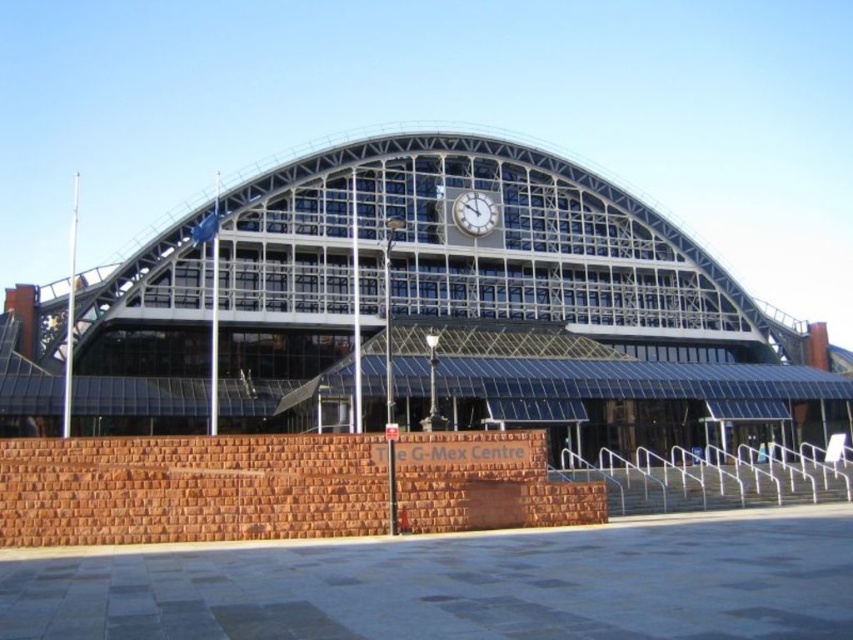
Question: Does glassy steel railway station at center appear on the right side of white metallic clock at center?

Choices:
 (A) no
 (B) yes

Answer: (B)

Question: Which of the following is the farthest from the observer?

Choices:
 (A) glassy steel railway station at center
 (B) white metallic clock at center

Answer: (B)

Question: Is glassy steel railway station at center positioned behind white metallic clock at center?

Choices:
 (A) no
 (B) yes

Answer: (A)

Question: Is glassy steel railway station at center positioned at the back of white metallic clock at center?

Choices:
 (A) no
 (B) yes

Answer: (A)